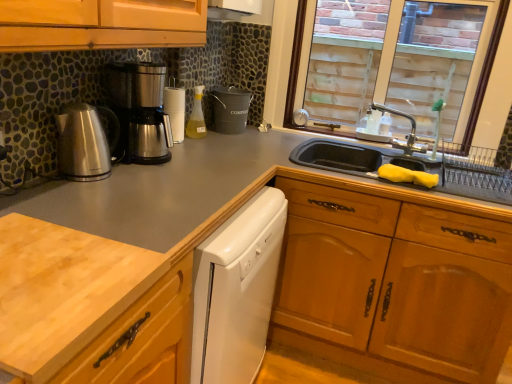
Question: Is clear glass window at upper right in contact with white glossy dishwasher at center?

Choices:
 (A) yes
 (B) no

Answer: (B)

Question: Is clear glass window at upper right not near white glossy dishwasher at center?

Choices:
 (A) no
 (B) yes

Answer: (B)

Question: From a real-world perspective, is clear glass window at upper right beneath white glossy dishwasher at center?

Choices:
 (A) no
 (B) yes

Answer: (A)

Question: Considering the relative sizes of clear glass window at upper right and white glossy dishwasher at center in the image provided, is clear glass window at upper right taller than white glossy dishwasher at center?

Choices:
 (A) no
 (B) yes

Answer: (A)

Question: From a real-world perspective, is clear glass window at upper right on white glossy dishwasher at center?

Choices:
 (A) no
 (B) yes

Answer: (B)

Question: Considering the relative sizes of clear glass window at upper right and white glossy dishwasher at center in the image provided, is clear glass window at upper right smaller than white glossy dishwasher at center?

Choices:
 (A) yes
 (B) no

Answer: (A)

Question: Does clear glass window at upper right have a lesser width compared to brushed metal kettle at left, positioned as the 1th kitchen appliance in front-to-back order?

Choices:
 (A) yes
 (B) no

Answer: (A)

Question: Can you confirm if clear glass window at upper right is shorter than brushed metal kettle at left, marked as the second kitchen appliance in a back-to-front arrangement?

Choices:
 (A) no
 (B) yes

Answer: (A)

Question: From the image's perspective, would you say clear glass window at upper right is positioned over brushed metal kettle at left, marked as the second kitchen appliance in a back-to-front arrangement?

Choices:
 (A) no
 (B) yes

Answer: (B)

Question: Is brushed metal kettle at left, marked as the second kitchen appliance in a back-to-front arrangement, located within clear glass window at upper right?

Choices:
 (A) no
 (B) yes

Answer: (A)

Question: Is brushed metal kettle at left, positioned as the 1th kitchen appliance in front-to-back order, at the back of clear glass window at upper right?

Choices:
 (A) no
 (B) yes

Answer: (A)

Question: From the image's perspective, is clear glass window at upper right located beneath brushed metal kettle at left, positioned as the 1th kitchen appliance in front-to-back order?

Choices:
 (A) no
 (B) yes

Answer: (A)

Question: Could clear glass window at upper right be considered to be inside brushed metal kettle at left, marked as the second kitchen appliance in a back-to-front arrangement?

Choices:
 (A) yes
 (B) no

Answer: (B)